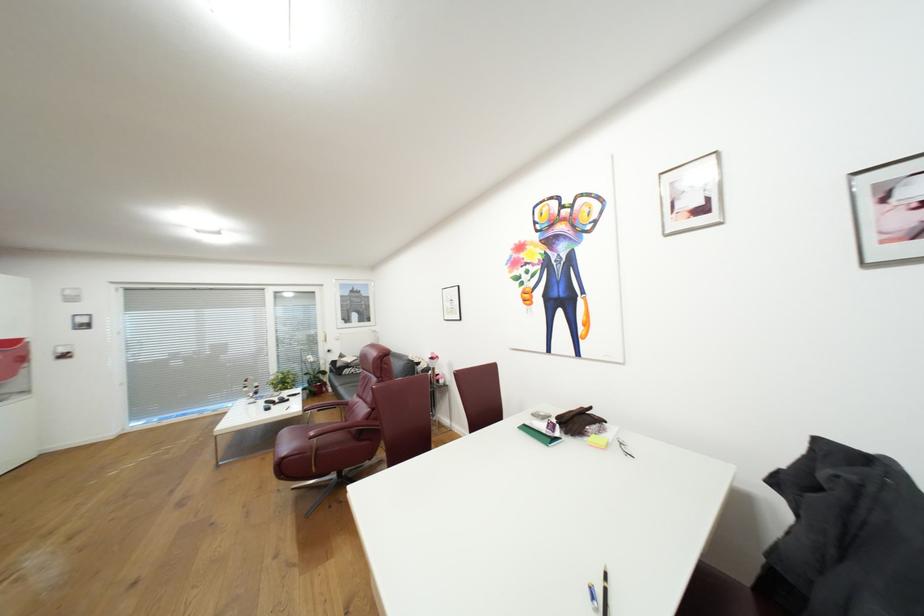
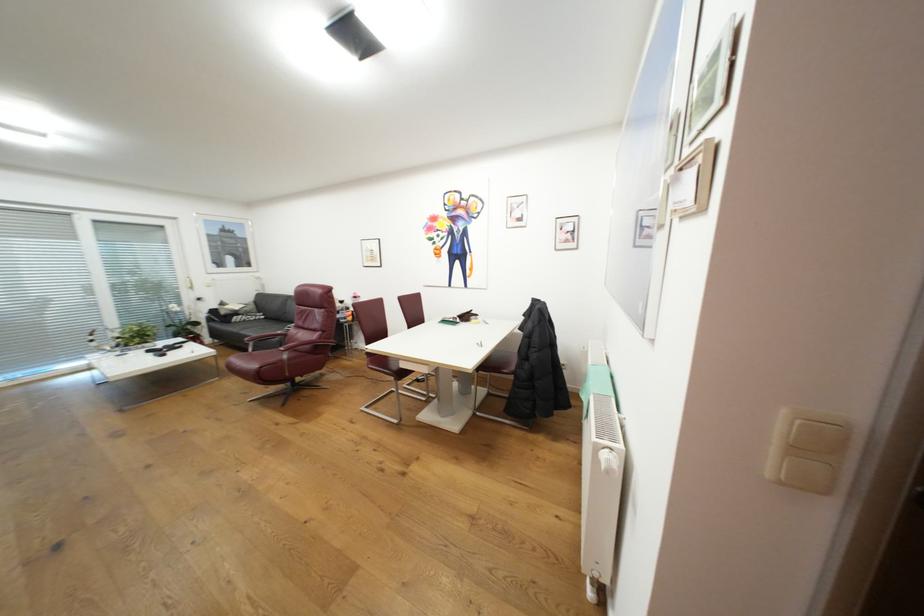
Find the pixel in the second image that matches [346,475] in the first image.

(300, 384)